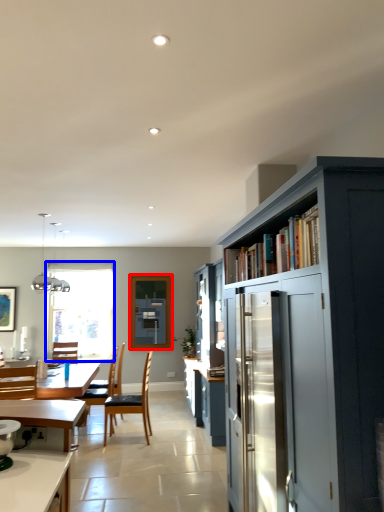
Question: Which object appears farthest to the camera in this image, window screen (highlighted by a red box) or window (highlighted by a blue box)?

Choices:
 (A) window screen
 (B) window

Answer: (B)